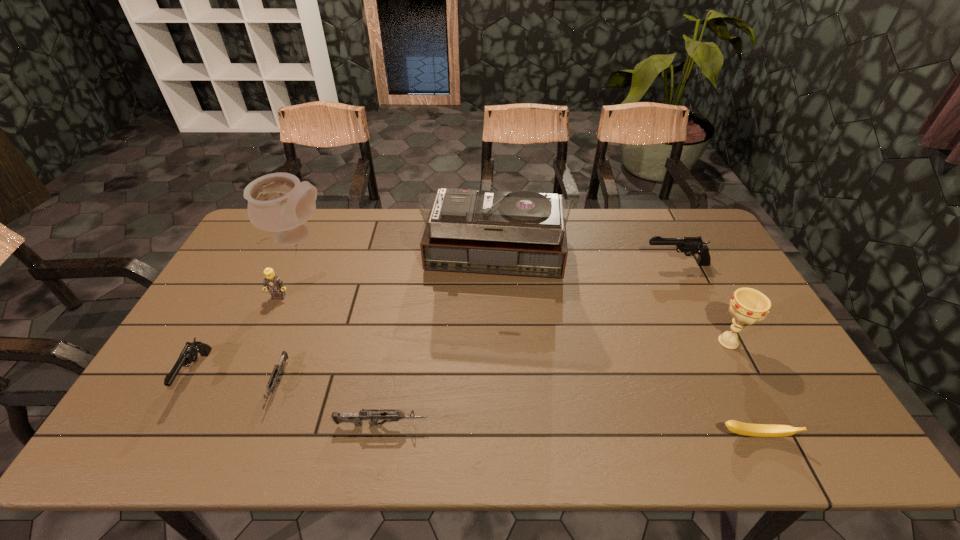
Identify the location of free space located 0.270m at the end of the barrel of the rightmost gun. (561, 264).

At what (x,y) coordinates should I click in order to perform the action: click on vacant region located in front of the Lego. Please return your answer as a coordinate pair (x, y). This screenshot has height=540, width=960. Looking at the image, I should click on (247, 365).

This screenshot has width=960, height=540. Find the location of `vacant space situated 0.060m at the end of the barrel of the second tallest gun`. vacant space situated 0.060m at the end of the barrel of the second tallest gun is located at coordinates (168, 424).

You are a GUI agent. You are given a task and a screenshot of the screen. Output one action in this format:
    pyautogui.click(x=<x>, y=<y>)
    Task: Click on the vacant space located 0.390m aimed along the barrel of the bigger grey gun
    This screenshot has height=540, width=960.
    Given the screenshot: What is the action you would take?
    [594, 425]

I want to click on vacant space located aimed along the barrel of the smaller grey gun, so click(x=259, y=434).

At what (x,y) coordinates should I click in order to perform the action: click on record player that is positioned at the far edge. Please return your answer as a coordinate pair (x, y). Looking at the image, I should click on (x=523, y=233).

The width and height of the screenshot is (960, 540). What are the coordinates of `pottery at the far edge` in the screenshot? It's located at (278, 202).

You are a GUI agent. You are given a task and a screenshot of the screen. Output one action in this format:
    pyautogui.click(x=<x>, y=<y>)
    Task: Click on the gun that is positioned at the near edge
    Image resolution: width=960 pixels, height=540 pixels.
    Given the screenshot: What is the action you would take?
    pyautogui.click(x=373, y=415)

You are a GUI agent. You are given a task and a screenshot of the screen. Output one action in this format:
    pyautogui.click(x=<x>, y=<y>)
    Task: Click on the banana present at the near edge
    
    Given the screenshot: What is the action you would take?
    pyautogui.click(x=756, y=430)

Identify the location of pottery located at the left edge. This screenshot has width=960, height=540. (278, 202).